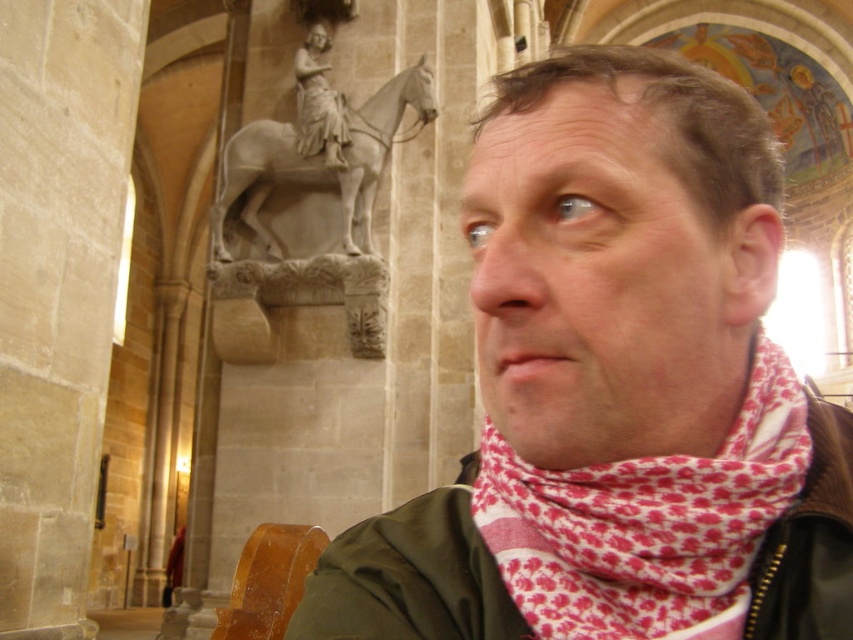
Question: Which object is closer to the camera taking this photo?

Choices:
 (A) wooden chair at lower left
 (B) gray stone statue at upper center

Answer: (A)

Question: Is wooden chair at lower left closer to camera compared to gray stone statue at upper center?

Choices:
 (A) yes
 (B) no

Answer: (A)

Question: Which object appears farthest from the camera in this image?

Choices:
 (A) gray stone statue at upper center
 (B) pink printed scarf at right
 (C) wooden chair at lower left

Answer: (A)

Question: Which object is closer to the camera taking this photo?

Choices:
 (A) gray stone statue at upper center
 (B) wooden chair at lower left
 (C) white marble statue at upper center
 (D) pink printed scarf at right

Answer: (D)

Question: Observing the image, what is the correct spatial positioning of pink printed scarf at center in reference to white marble statue at upper center?

Choices:
 (A) below
 (B) above

Answer: (A)

Question: Can you confirm if pink printed scarf at right is bigger than wooden chair at lower left?

Choices:
 (A) yes
 (B) no

Answer: (B)